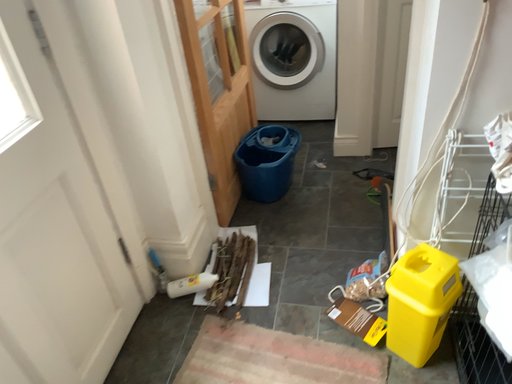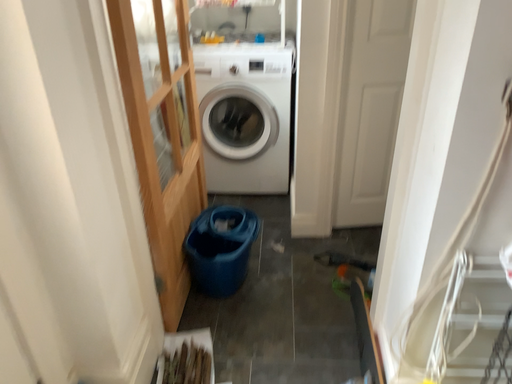
Question: Which way did the camera rotate in the video?

Choices:
 (A) rotated upward
 (B) rotated downward

Answer: (A)